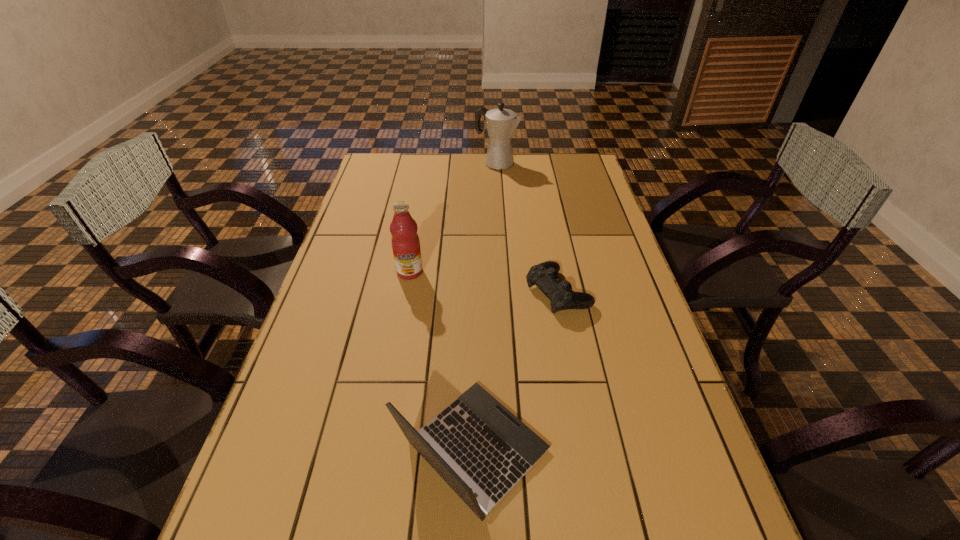
You are a GUI agent. You are given a task and a screenshot of the screen. Output one action in this format:
    pyautogui.click(x=<x>, y=<y>)
    Task: Click on the coffeepot
    
    Given the screenshot: What is the action you would take?
    click(x=501, y=123)

The height and width of the screenshot is (540, 960). I want to click on fruit juice, so click(x=405, y=241).

The image size is (960, 540). What are the coordinates of `the second shortest object` in the screenshot? It's located at click(x=476, y=445).

Where is `the nearest object`? The image size is (960, 540). the nearest object is located at coordinates (476, 445).

Where is `control`? This screenshot has width=960, height=540. control is located at coordinates (545, 276).

Locate an element on the screen. The width and height of the screenshot is (960, 540). vacant space situated 0.120m on the front of the coffeepot is located at coordinates (498, 186).

I want to click on free location located on the label of the fruit juice, so click(x=405, y=295).

I want to click on free region located at the front screen of the laptop_computer, so click(593, 450).

The height and width of the screenshot is (540, 960). Identify the location of vacant space located 0.100m on the back of the control. (550, 248).

You are a GUI agent. You are given a task and a screenshot of the screen. Output one action in this format:
    pyautogui.click(x=<x>, y=<y>)
    Task: Click on the object at the far edge
    This screenshot has height=540, width=960.
    Given the screenshot: What is the action you would take?
    pyautogui.click(x=501, y=123)